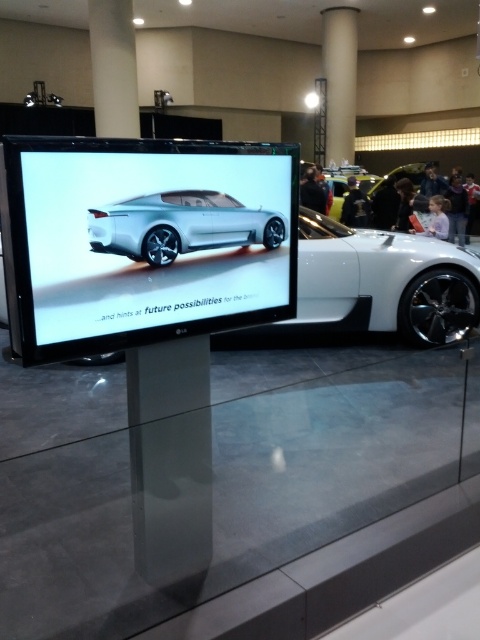
Question: Considering the relative positions of transparent glass table at center and white matte/sleek sports car at center in the image provided, where is transparent glass table at center located with respect to white matte/sleek sports car at center?

Choices:
 (A) below
 (B) above

Answer: (A)

Question: Is matte silver car at center further to the viewer compared to white matte/sleek sports car at center?

Choices:
 (A) yes
 (B) no

Answer: (B)

Question: Which is farther from the white matte/sleek sports car at center?

Choices:
 (A) matte silver car at center
 (B) glossy glass pillar at center

Answer: (B)

Question: Among these points, which one is nearest to the camera?

Choices:
 (A) (247, 241)
 (B) (421, 248)
 (C) (61, 564)

Answer: (A)

Question: Which point is closer to the camera taking this photo?

Choices:
 (A) (245, 518)
 (B) (247, 209)
 (C) (156, 552)
 (D) (183, 150)

Answer: (D)

Question: Is white matte/sleek sports car at center to the left of sleek silver car at center from the viewer's perspective?

Choices:
 (A) yes
 (B) no

Answer: (B)